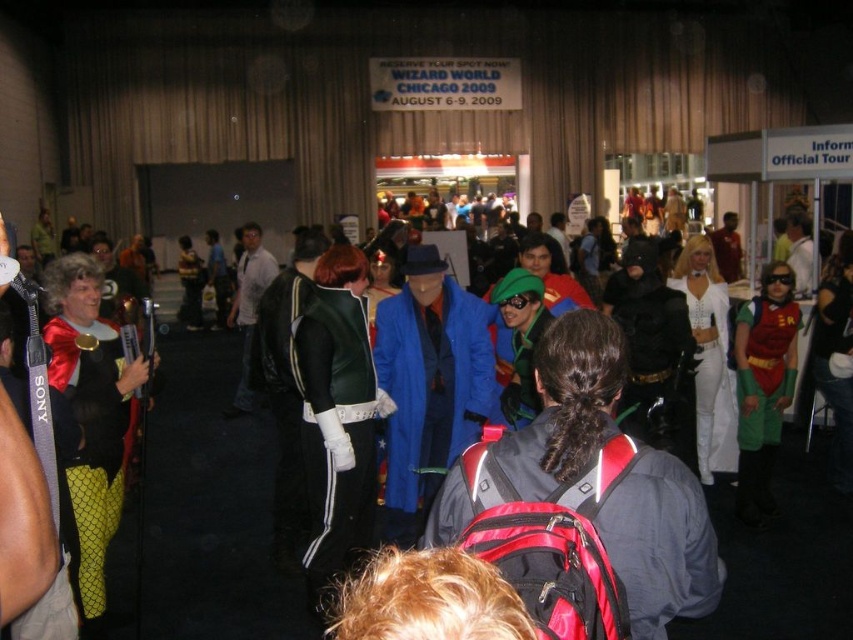
You are a photographer at Wizard World Chicago 2009. You need to capture a photo of the blue fabric coat at center and white leather pants at center. Which object is wider in the image?

The blue fabric coat at center is wider than the white leather pants at center according to the description.

You are attending Wizard World Chicago 2009 and want to take a photo of the SONY microphone holder. You notice the red synthetic backpack at center and the green leather jacket at center in your viewfinder. Which object is shorter in height?

The red synthetic backpack at center is not as tall as the green leather jacket at center, so the red synthetic backpack at center is shorter in height.